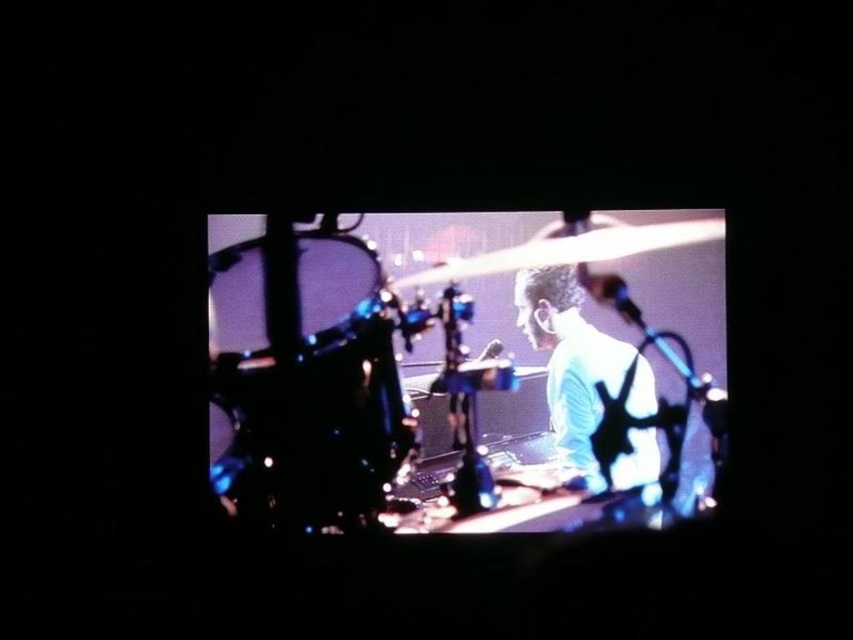
You are a stagehand trying to adjust the lighting for the drummer. The drummer is facing the shiny black drum at left. Where should you position the spotlight to best illuminate the drummer?

The shiny black drum at left is located at point (305, 380). To best illuminate the drummer facing it, position the spotlight opposite the drum, likely around point (546, 259), to cast light towards the drummer from the front.

You are watching a live performance on the TV screen and notice two points marked on the screen. The first point is at coordinates point (x=287, y=259), and the second is at point (x=628, y=365). Which point is closer to you?

Point (x=287, y=259) is further to the viewer than point (x=628, y=365), so the point closer to you is point (x=628, y=365).